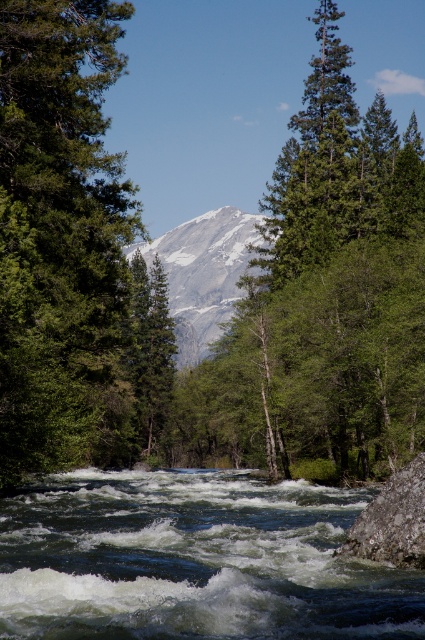
You are a hiker trying to cross the river using the gray rough rock at lower right. However, you notice the green matte tree at center is blocking your path. Can you still reach the rock without moving the tree?

The gray rough rock at lower right is behind the green matte tree at center, so you cannot reach the rock without moving the tree because it is obstructed by the tree.

You are a hiker trying to cross the river using the gray rough rock at lower right. The green matte tree at center is blocking your path. Which object is wider, making it harder to navigate around?

The green matte tree at center is wider than the gray rough rock at lower right, making it harder to navigate around.

You are standing at the edge of the river in the forest scene and want to reach a specific location marked by point (62,8) and another marked by point (388,484). Which point is closer to you?

Point (62,8) is closer to you because it is further to the viewer than point (388,484), meaning it is nearer in the scene.